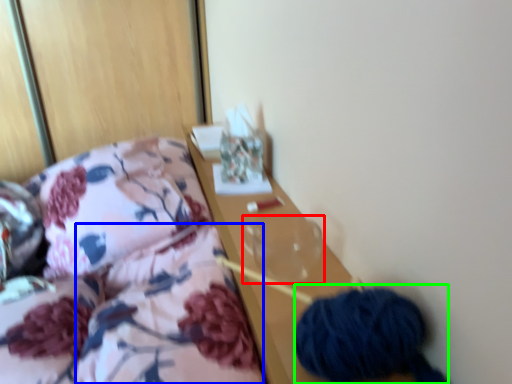
Question: Estimate the real-world distances between objects in this image. Which object is farther from glass vase (highlighted by a red box), quilt (highlighted by a blue box) or material (highlighted by a green box)?

Choices:
 (A) quilt
 (B) material

Answer: (B)